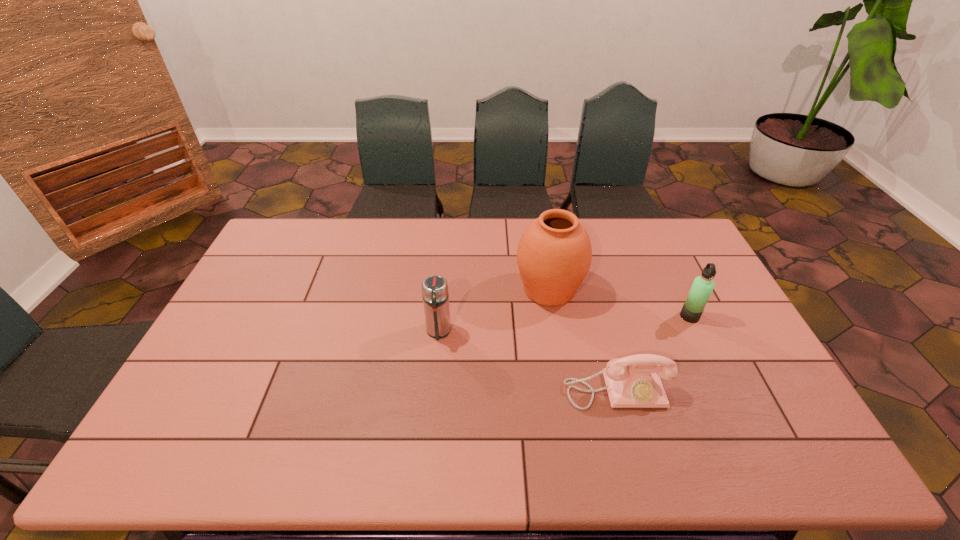
Find the location of a particular element. The width and height of the screenshot is (960, 540). vacant space at the far edge of the desktop is located at coordinates (495, 226).

In the image, there is a desktop. Where is `vacant space at the near edge`? vacant space at the near edge is located at coordinates (587, 448).

Find the location of `vacant space at the left edge of the desktop`. vacant space at the left edge of the desktop is located at coordinates (268, 262).

In the image, there is a desktop. Identify the location of vacant space at the far left corner. (305, 226).

This screenshot has width=960, height=540. In the image, there is a desktop. In order to click on free region at the near left corner in this screenshot , I will do `click(169, 442)`.

Where is `free location at the near right corner`? This screenshot has height=540, width=960. free location at the near right corner is located at coordinates (828, 469).

Where is `vacant area that lies between the leftmost object and the urn`? vacant area that lies between the leftmost object and the urn is located at coordinates (493, 310).

The image size is (960, 540). Identify the location of empty location between the tallest object and the telephone. [583, 340].

The height and width of the screenshot is (540, 960). Identify the location of free spot between the rightmost object and the urn. (619, 302).

The width and height of the screenshot is (960, 540). In order to click on vacant space that is in between the right thermos bottle and the telephone in this screenshot , I will do `click(653, 353)`.